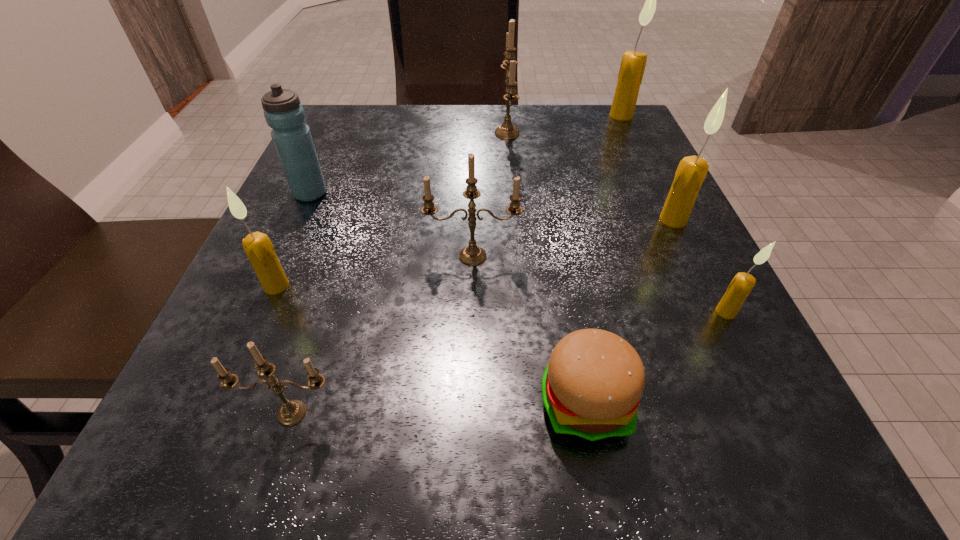
I want to click on the biggest cream candle, so tap(633, 63).

This screenshot has width=960, height=540. What are the coordinates of `the tallest object` in the screenshot? It's located at (633, 63).

This screenshot has width=960, height=540. Identify the location of the biggest metallic candle. (507, 130).

Image resolution: width=960 pixels, height=540 pixels. Identify the location of the third smallest cream candle. (691, 172).

Identify the location of the fifth nearest candle. (691, 172).

You are a GUI agent. You are given a task and a screenshot of the screen. Output one action in this format:
    pyautogui.click(x=<x>, y=<y>)
    Task: Click on the third farthest object
    The height and width of the screenshot is (540, 960).
    Given the screenshot: What is the action you would take?
    pyautogui.click(x=283, y=112)

The width and height of the screenshot is (960, 540). I want to click on the second nearest cream candle, so click(x=258, y=247).

The width and height of the screenshot is (960, 540). What are the coordinates of `the second smallest cream candle` in the screenshot? It's located at (258, 247).

This screenshot has width=960, height=540. Find the location of `the second farthest metallic candle`. the second farthest metallic candle is located at coordinates (472, 255).

In order to click on the fourth nearest candle in this screenshot , I will do `click(472, 255)`.